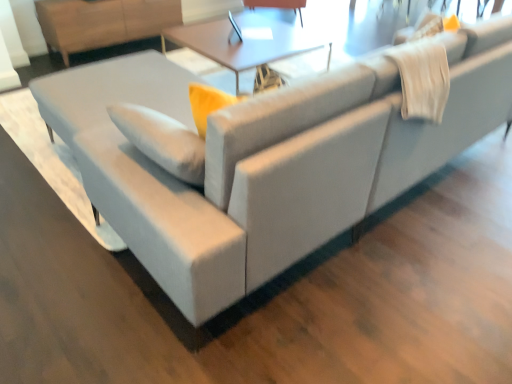
Question: Is light brown wood dresser at upper left positioned beyond the bounds of matte white table at center?

Choices:
 (A) no
 (B) yes

Answer: (B)

Question: Does light brown wood dresser at upper left have a greater height compared to matte white table at center?

Choices:
 (A) no
 (B) yes

Answer: (B)

Question: From the image's perspective, would you say light brown wood dresser at upper left is shown under matte white table at center?

Choices:
 (A) no
 (B) yes

Answer: (A)

Question: From a real-world perspective, is light brown wood dresser at upper left under matte white table at center?

Choices:
 (A) yes
 (B) no

Answer: (B)

Question: Is light brown wood dresser at upper left in front of matte white table at center?

Choices:
 (A) yes
 (B) no

Answer: (B)

Question: Looking at their shapes, would you say matte white table at center is wider or thinner than matte black swivel chair at upper center?

Choices:
 (A) wide
 (B) thin

Answer: (A)

Question: Does point (x=181, y=41) appear closer or farther from the camera than point (x=266, y=3)?

Choices:
 (A) closer
 (B) farther

Answer: (A)

Question: Which is correct: matte white table at center is inside matte black swivel chair at upper center, or outside of it?

Choices:
 (A) outside
 (B) inside

Answer: (A)

Question: From the image's perspective, is matte white table at center located above or below matte black swivel chair at upper center?

Choices:
 (A) below
 (B) above

Answer: (A)

Question: In terms of height, does matte white table at center look taller or shorter compared to light brown wood dresser at upper left?

Choices:
 (A) tall
 (B) short

Answer: (B)

Question: Considering the positions of matte white table at center and light brown wood dresser at upper left in the image, is matte white table at center bigger or smaller than light brown wood dresser at upper left?

Choices:
 (A) small
 (B) big

Answer: (B)

Question: Considering the positions of matte white table at center and light brown wood dresser at upper left in the image, is matte white table at center wider or thinner than light brown wood dresser at upper left?

Choices:
 (A) wide
 (B) thin

Answer: (A)

Question: From a real-world perspective, is matte white table at center above or below light brown wood dresser at upper left?

Choices:
 (A) above
 (B) below

Answer: (B)

Question: In terms of size, does light brown wood dresser at upper left appear bigger or smaller than matte black swivel chair at upper center?

Choices:
 (A) big
 (B) small

Answer: (A)

Question: Considering their positions, is light brown wood dresser at upper left located in front of or behind matte black swivel chair at upper center?

Choices:
 (A) behind
 (B) front

Answer: (B)